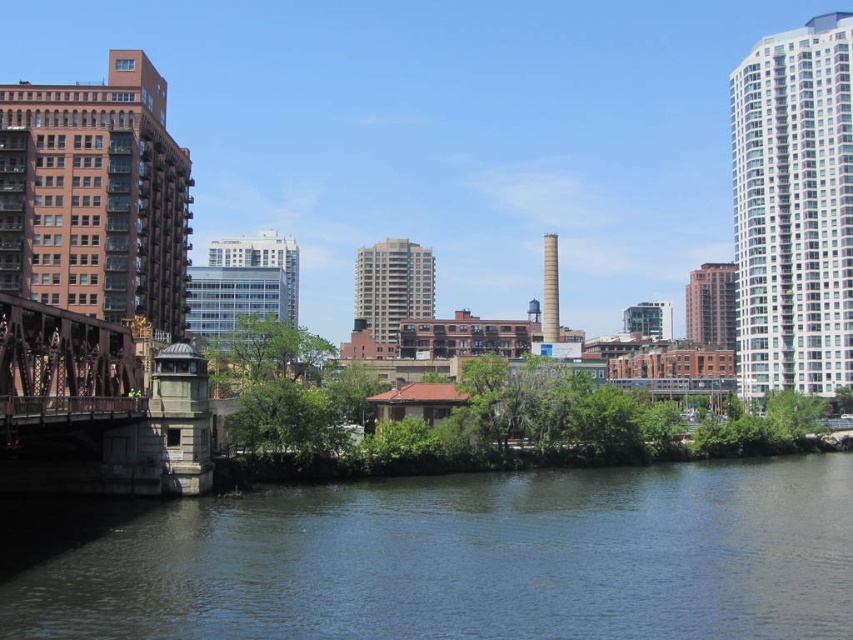
You are standing at the riverside and want to take a photo of the dark blue water at lower center and the rusty metal bridge at left. Which object should you focus on first to ensure both are in the frame?

You should focus on the dark blue water at lower center first because it is closer to the viewer than the rusty metal bridge at left, so adjusting the camera to capture the closer object ensures the bridge will also be in the frame.